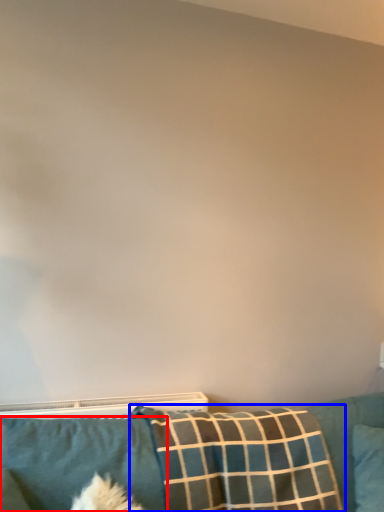
Question: Which point is further to the camera, pillow (highlighted by a red box) or pillow (highlighted by a blue box)?

Choices:
 (A) pillow
 (B) pillow

Answer: (B)